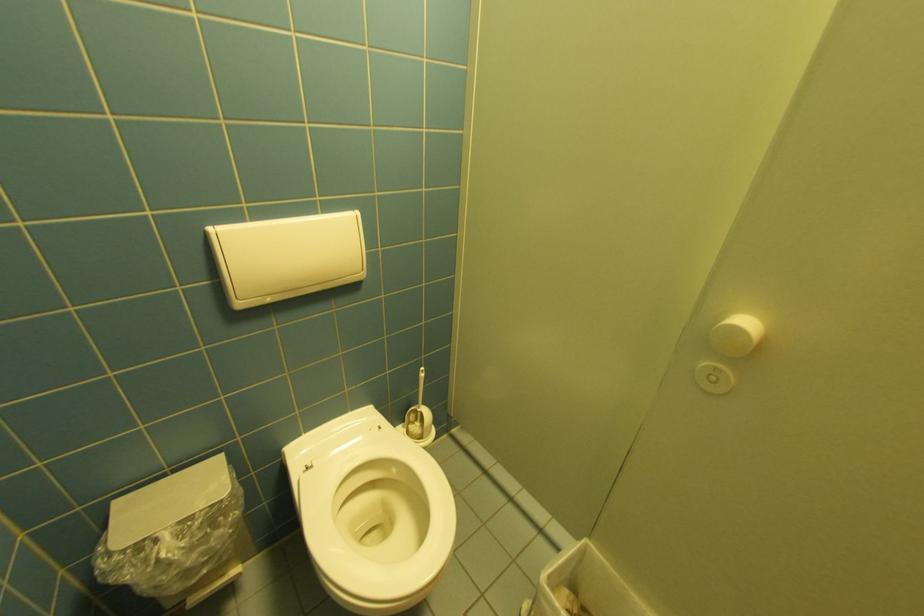
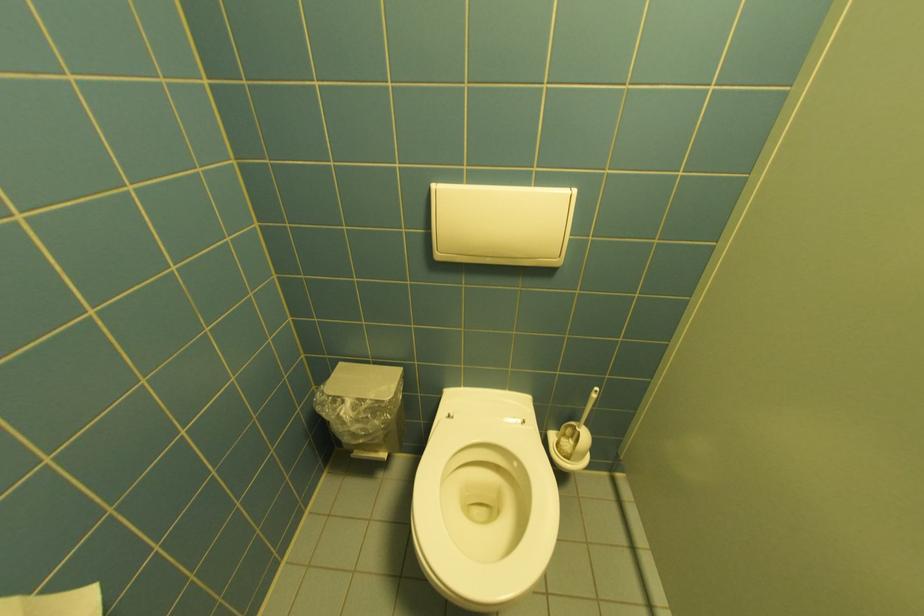
The point at (215,230) is marked in the first image. Where is the corresponding point in the second image?

(440, 185)